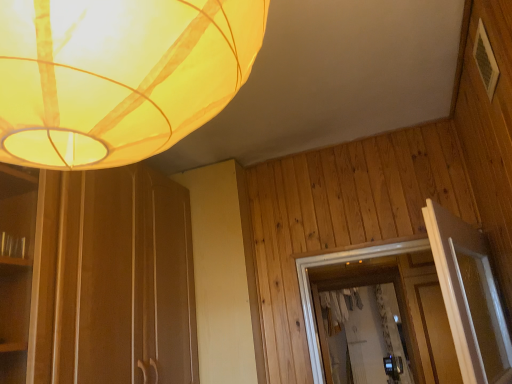
What do you see at coordinates (118, 76) in the screenshot? The image size is (512, 384). I see `translucent yellow fabric lampshade at upper left` at bounding box center [118, 76].

Identify the location of translucent yellow fabric lampshade at upper left. (118, 76).

In the scene shown: What is the approximate height of translucent yellow fabric lampshade at upper left?

18.73 inches.

This screenshot has width=512, height=384. What are the coordinates of `white textured frame at upper right` in the screenshot? It's located at (485, 60).

Describe the element at coordinates (485, 60) in the screenshot. The height and width of the screenshot is (384, 512). I see `white textured frame at upper right` at that location.

The width and height of the screenshot is (512, 384). I want to click on translucent yellow fabric lampshade at upper left, so click(x=118, y=76).

Based on their positions, is translucent yellow fabric lampshade at upper left located to the left or right of white textured frame at upper right?

Clearly, translucent yellow fabric lampshade at upper left is on the left of white textured frame at upper right in the image.

Consider the image. Is translucent yellow fabric lampshade at upper left in front of or behind white textured frame at upper right in the image?

In the image, translucent yellow fabric lampshade at upper left appears in front of white textured frame at upper right.

Considering the points (169, 144) and (495, 69), which point is in front, point (169, 144) or point (495, 69)?

Point (169, 144)

From the image's perspective, does translucent yellow fabric lampshade at upper left appear higher than white textured frame at upper right?

No, from the image's perspective, translucent yellow fabric lampshade at upper left is not above white textured frame at upper right.

From a real-world perspective, is translucent yellow fabric lampshade at upper left located higher than white textured frame at upper right?

No.

Is translucent yellow fabric lampshade at upper left wider or thinner than white textured frame at upper right?

translucent yellow fabric lampshade at upper left is wider than white textured frame at upper right.

From their relative heights in the image, would you say translucent yellow fabric lampshade at upper left is taller or shorter than white textured frame at upper right?

translucent yellow fabric lampshade at upper left is taller than white textured frame at upper right.

Which of these two, translucent yellow fabric lampshade at upper left or white textured frame at upper right, is smaller?

white textured frame at upper right.

Do you think translucent yellow fabric lampshade at upper left is within white textured frame at upper right, or outside of it?

translucent yellow fabric lampshade at upper left is spatially situated outside white textured frame at upper right.

Is there a large distance between translucent yellow fabric lampshade at upper left and white textured frame at upper right?

Yes, translucent yellow fabric lampshade at upper left and white textured frame at upper right are located far from each other.

Could you tell me if translucent yellow fabric lampshade at upper left is facing white textured frame at upper right?

No, translucent yellow fabric lampshade at upper left is not turned towards white textured frame at upper right.

How many degrees apart are the facing directions of translucent yellow fabric lampshade at upper left and white textured frame at upper right?

The angle between the facing direction of translucent yellow fabric lampshade at upper left and the facing direction of white textured frame at upper right is 88.4 degrees.

Where is `lamp that appears in front of the white textured frame at upper right`? The width and height of the screenshot is (512, 384). lamp that appears in front of the white textured frame at upper right is located at coordinates (118, 76).

From the picture: Considering the positions of objects white textured frame at upper right and translucent yellow fabric lampshade at upper left in the image provided, who is more to the right, white textured frame at upper right or translucent yellow fabric lampshade at upper left?

white textured frame at upper right is more to the right.

Which object is closer to the camera taking this photo, white textured frame at upper right or translucent yellow fabric lampshade at upper left?

translucent yellow fabric lampshade at upper left is closer to the camera.

Which is farther from the camera, (476,64) or (32,29)?

The point (476,64) is farther.

From the image's perspective, is white textured frame at upper right located above or below translucent yellow fabric lampshade at upper left?

Clearly, from the image's perspective, white textured frame at upper right is above translucent yellow fabric lampshade at upper left.

From a real-world perspective, between white textured frame at upper right and translucent yellow fabric lampshade at upper left, who is vertically higher?

white textured frame at upper right, from a real-world perspective.

Looking at this image, looking at their sizes, would you say white textured frame at upper right is wider or thinner than translucent yellow fabric lampshade at upper left?

white textured frame at upper right is thinner than translucent yellow fabric lampshade at upper left.

Considering the sizes of objects white textured frame at upper right and translucent yellow fabric lampshade at upper left in the image provided, who is shorter, white textured frame at upper right or translucent yellow fabric lampshade at upper left?

Standing shorter between the two is white textured frame at upper right.

Considering the sizes of white textured frame at upper right and translucent yellow fabric lampshade at upper left in the image, is white textured frame at upper right bigger or smaller than translucent yellow fabric lampshade at upper left?

In the image, white textured frame at upper right appears to be smaller than translucent yellow fabric lampshade at upper left.

Is white textured frame at upper right spatially inside translucent yellow fabric lampshade at upper left, or outside of it?

white textured frame at upper right exists outside the volume of translucent yellow fabric lampshade at upper left.

Is white textured frame at upper right not near translucent yellow fabric lampshade at upper left?

white textured frame at upper right is positioned a significant distance from translucent yellow fabric lampshade at upper left.

Is white textured frame at upper right facing towards translucent yellow fabric lampshade at upper left?

No.

What's the angular difference between white textured frame at upper right and translucent yellow fabric lampshade at upper left's facing directions?

The angle between the facing direction of white textured frame at upper right and the facing direction of translucent yellow fabric lampshade at upper left is 88.4 degrees.

Image resolution: width=512 pixels, height=384 pixels. I want to click on lamp lying in front of the white textured frame at upper right, so 118,76.

The image size is (512, 384). Identify the location of panel above the translucent yellow fabric lampshade at upper left (from the image's perspective). (485, 60).

Locate an element on the screen. panel behind the translucent yellow fabric lampshade at upper left is located at coordinates (485, 60).